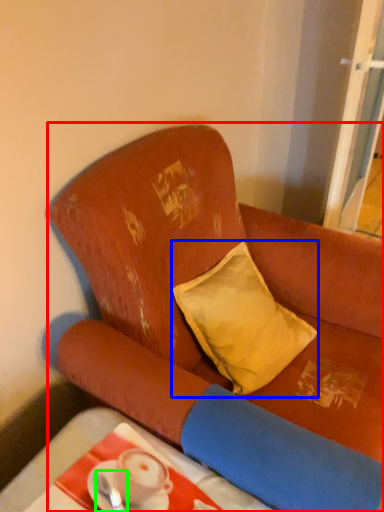
Question: Which is nearer to the studio couch (highlighted by a red box)? pillow (highlighted by a blue box) or tableware (highlighted by a green box).

Choices:
 (A) pillow
 (B) tableware

Answer: (A)